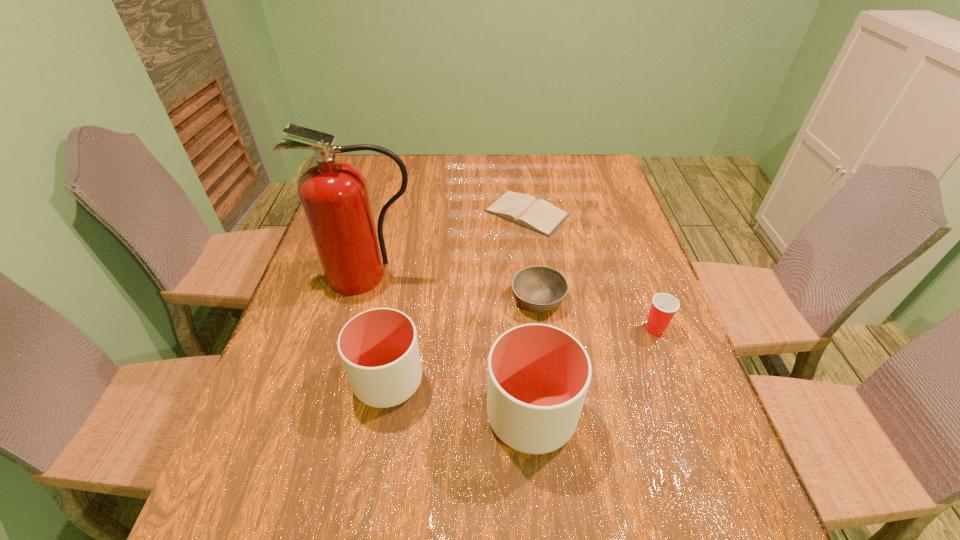
I want to click on free space at the near edge of the desktop, so click(408, 444).

In the image, there is a desktop. At what (x,y) coordinates should I click in order to perform the action: click on free space at the left edge. Please return your answer as a coordinate pair (x, y). Looking at the image, I should click on (338, 379).

You are a GUI agent. You are given a task and a screenshot of the screen. Output one action in this format:
    pyautogui.click(x=<x>, y=<y>)
    Task: Click on the vacant area at the right edge of the desktop
    
    Given the screenshot: What is the action you would take?
    pyautogui.click(x=687, y=395)

The width and height of the screenshot is (960, 540). What are the coordinates of `vacant space at the far left corner` in the screenshot? It's located at (383, 164).

Image resolution: width=960 pixels, height=540 pixels. In order to click on vacant space at the near left corner of the desktop in this screenshot , I will do `click(311, 453)`.

This screenshot has height=540, width=960. I want to click on vacant space in between the fire extinguisher and the shortest object, so click(x=447, y=244).

You are a GUI agent. You are given a task and a screenshot of the screen. Output one action in this format:
    pyautogui.click(x=<x>, y=<y>)
    Task: Click on the free space between the fire extinguisher and the Dixie cup
    Image resolution: width=960 pixels, height=540 pixels.
    Given the screenshot: What is the action you would take?
    pyautogui.click(x=512, y=302)

This screenshot has height=540, width=960. I want to click on free spot between the left cup and the farthest object, so click(457, 296).

This screenshot has width=960, height=540. I want to click on unoccupied position between the fourth shortest object and the right cup, so click(460, 398).

Locate an element on the screen. vacant area that lies between the taller cup and the farthest object is located at coordinates click(529, 314).